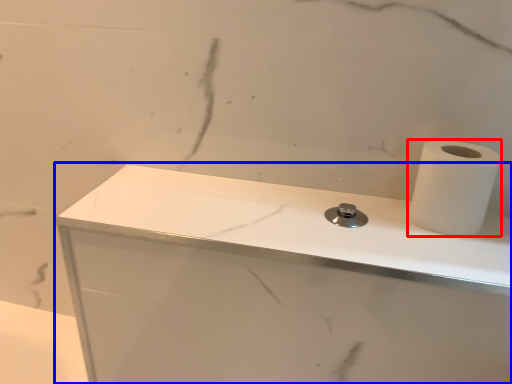
Question: Which object is further to the camera taking this photo, paper towel (highlighted by a red box) or counter top (highlighted by a blue box)?

Choices:
 (A) paper towel
 (B) counter top

Answer: (A)